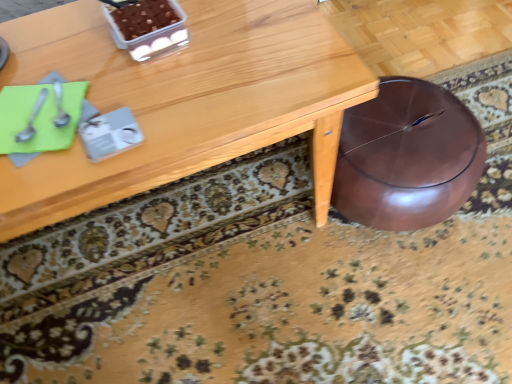
The height and width of the screenshot is (384, 512). I want to click on blank space above glossy wood table at center (from a real-world perspective), so click(128, 68).